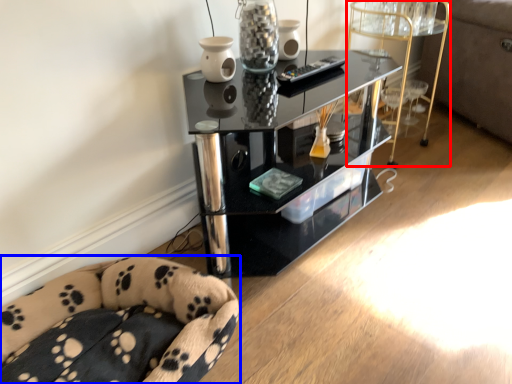
Question: Which point is further to the camera, side table (highlighted by a red box) or furniture (highlighted by a blue box)?

Choices:
 (A) side table
 (B) furniture

Answer: (A)